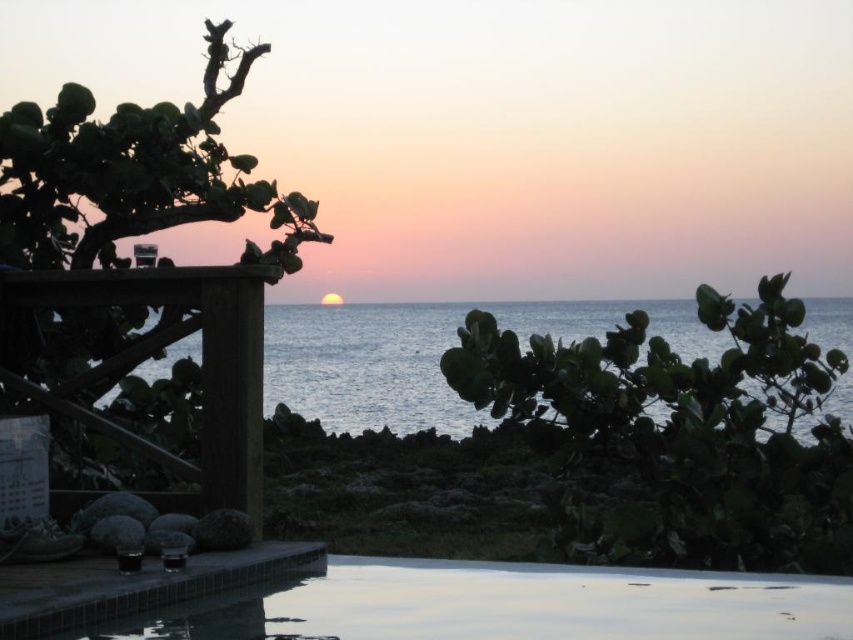
Who is shorter, smooth concrete pool at center or blue water at center?

Standing shorter between the two is smooth concrete pool at center.

Who is more forward, (787, 624) or (328, 388)?

Point (787, 624)

You are a GUI agent. You are given a task and a screenshot of the screen. Output one action in this format:
    pyautogui.click(x=<x>, y=<y>)
    Task: Click on the smooth concrete pool at center
    Image resolution: width=853 pixels, height=640 pixels.
    Given the screenshot: What is the action you would take?
    pyautogui.click(x=436, y=602)

This screenshot has height=640, width=853. Describe the element at coordinates (436, 602) in the screenshot. I see `smooth concrete pool at center` at that location.

Can you confirm if smooth concrete pool at center is bigger than wooden rail at left?

Indeed, smooth concrete pool at center has a larger size compared to wooden rail at left.

Between point (651, 632) and point (221, 269), which one is positioned behind?

Positioned behind is point (221, 269).

At what (x,y) coordinates should I click in order to perform the action: click on smooth concrete pool at center. Please return your answer as a coordinate pair (x, y). Image resolution: width=853 pixels, height=640 pixels. Looking at the image, I should click on (436, 602).

Is point (181, 355) positioned in front of point (202, 500)?

No, it is not.

Which is more to the left, blue water at center or wooden rail at left?

wooden rail at left is more to the left.

Where is `blue water at center`? The height and width of the screenshot is (640, 853). blue water at center is located at coordinates (407, 358).